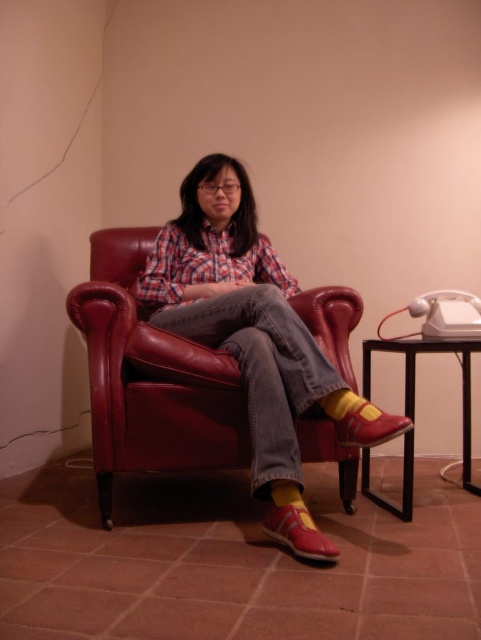
Which is in front, point (459, 339) or point (280, 532)?

Positioned in front is point (280, 532).

Image resolution: width=481 pixels, height=640 pixels. Find the location of `black metal side table at lower right`. black metal side table at lower right is located at coordinates [x=415, y=381].

Can you confirm if matte leather chair at center is taller than matte red shoe at lower center?

Yes, matte leather chair at center is taller than matte red shoe at lower center.

Image resolution: width=481 pixels, height=640 pixels. What do you see at coordinates (241, 316) in the screenshot? I see `matte leather chair at center` at bounding box center [241, 316].

I want to click on matte leather chair at center, so (x=241, y=316).

Who is positioned more to the left, matte red shoe at lower center or shiny red leather shoe at lower right?

matte red shoe at lower center is more to the left.

Can you confirm if matte red shoe at lower center is thinner than shiny red leather shoe at lower right?

Indeed, matte red shoe at lower center has a lesser width compared to shiny red leather shoe at lower right.

Does point (306, 518) lie in front of point (392, 435)?

No, (306, 518) is behind (392, 435).

Locate an element on the screen. The height and width of the screenshot is (640, 481). matte red shoe at lower center is located at coordinates (298, 531).